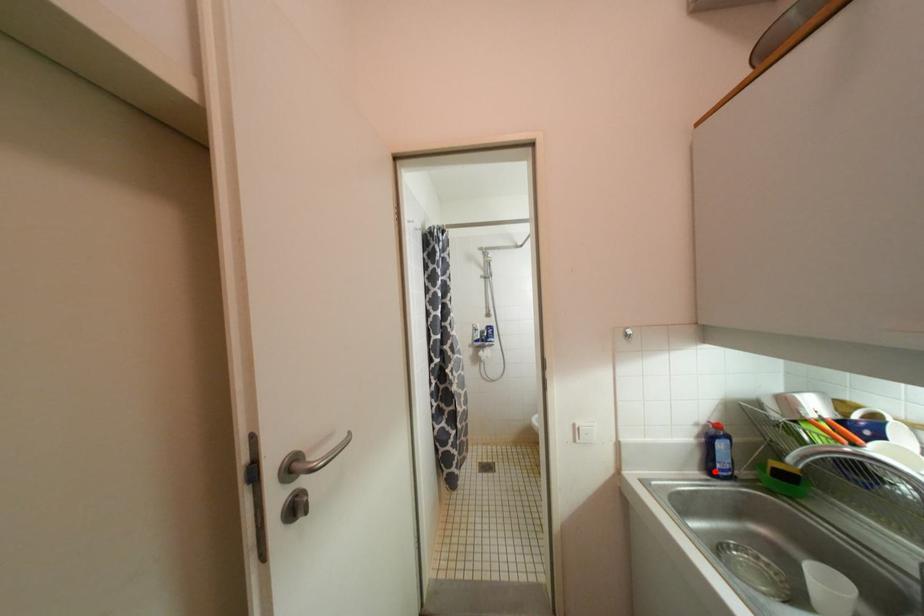
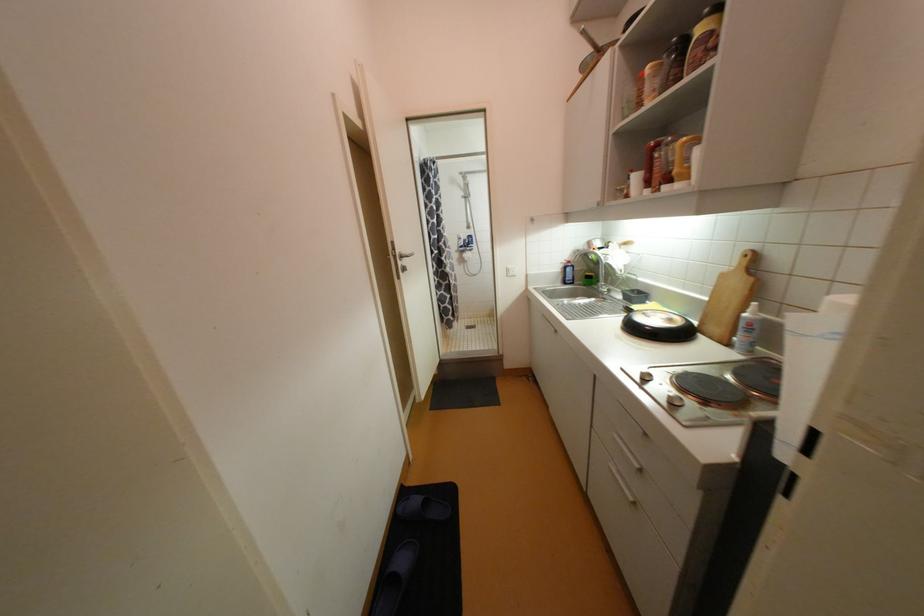
Find the pixel in the second image that matches the highlighted location in the first image.

(569, 283)